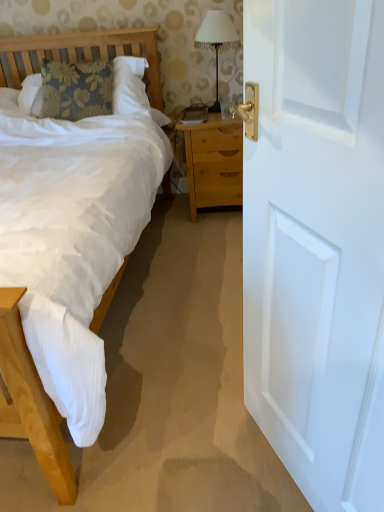
Question: Considering the relative positions of light brown wooden nightstand at center and white painted wood door at right in the image provided, is light brown wooden nightstand at center to the left or to the right of white painted wood door at right?

Choices:
 (A) right
 (B) left

Answer: (B)

Question: In terms of height, does light brown wooden nightstand at center look taller or shorter compared to white painted wood door at right?

Choices:
 (A) tall
 (B) short

Answer: (B)

Question: Considering the real-world distances, which object is closest to the white fabric lampshade at upper center?

Choices:
 (A) white painted wood door at right
 (B) light brown wooden nightstand at center

Answer: (B)

Question: Which is farther from the white fabric lampshade at upper center?

Choices:
 (A) white painted wood door at right
 (B) light brown wooden nightstand at center

Answer: (A)